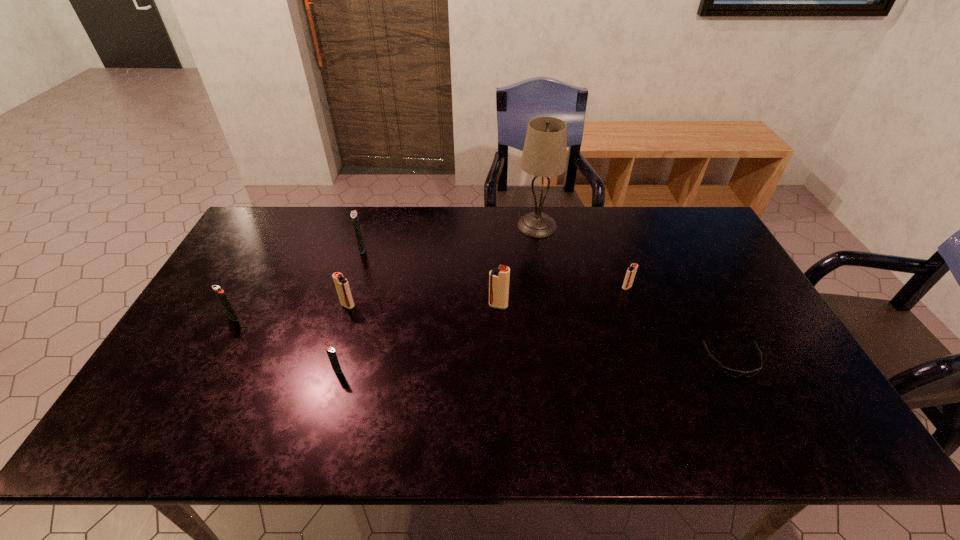
I want to click on vacant region between the leftmost red igniter and the shortest object, so click(540, 333).

Locate an element on the screen. The height and width of the screenshot is (540, 960). vacant space that's between the fifth object from left to right and the biggest black igniter is located at coordinates (430, 277).

Locate an element on the screen. The image size is (960, 540). free space between the tallest object and the sunglasses is located at coordinates (636, 293).

I want to click on vacant area that lies between the rightmost black igniter and the tallest object, so click(437, 298).

At what (x,y) coordinates should I click in order to perform the action: click on unoccupied position between the leftmost black igniter and the second smallest red igniter. Please return your answer as a coordinate pair (x, y). The height and width of the screenshot is (540, 960). Looking at the image, I should click on (291, 312).

This screenshot has width=960, height=540. I want to click on free space that is in between the second biggest black igniter and the smallest black igniter, so click(285, 344).

In order to click on object that is the second closest to the farthest igniter in this screenshot , I will do `click(220, 293)`.

In order to click on the third closest object to the shortest object in this screenshot , I will do `click(544, 154)`.

What are the coordinates of `the fifth closest igniter to the second igniter from right to left` in the screenshot? It's located at (220, 293).

Identify which igniter is located as the second nearest to the sunglasses. Please provide its 2D coordinates. Your answer should be formatted as a tuple, i.e. [(x, y)], where the tuple contains the x and y coordinates of a point satisfying the conditions above.

[(499, 278)]